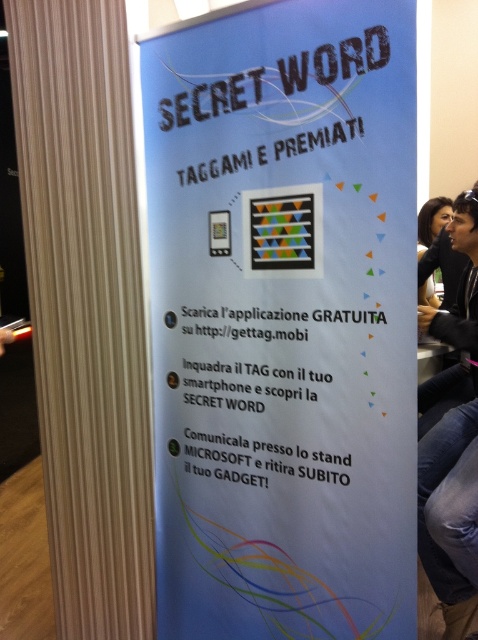
You are designing a layout for a promotional event and have a blue paper poster at center and a matte black hair at upper right. Based on the scene description, which object is wider?

The blue paper poster at center is wider than the matte black hair at upper right because its width surpasses the latter.

What is located at the point with coordinates (x=283, y=320) on the light blue promotional banner?

The point at coordinates (x=283, y=320) is on the blue paper poster at center.

You are standing in front of the promotional banner for the event titled SECRET WORD. You see two points on the banner at coordinates point (433,314) and point (423,280). Which point is closer to you?

Point (433,314) is closer to the viewer than point (423,280).